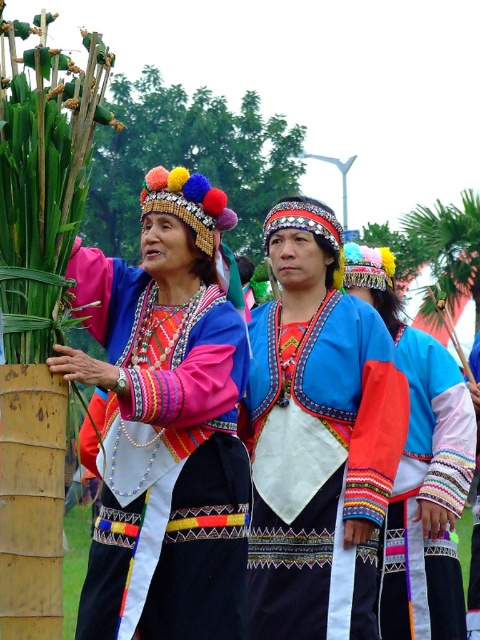
You are a photographer trying to capture the matte black dress at center in the scene. Based on the coordinates provided, where exactly should you aim your camera to ensure the dress is centered in your shot?

The matte black dress at center is located at coordinates point (166, 460), so aim your camera there to center it.

You are organizing a fashion show and need to decide which outfit to display first. The blue satin blouse at center and the multicolored woven fabric at center are both candidates. Based on their widths, which one should be chosen if you want the wider one displayed first?

The blue satin blouse at center might be wider than multicolored woven fabric at center, so it should be displayed first if you want the wider one.

You are a photographer trying to capture the blue satin blouse at center and the multicolored woven fabric at center in a single shot. Which object should you focus on first to ensure both are in sharp focus?

The blue satin blouse at center is closer to the viewer than the multicolored woven fabric at center, so you should focus on the blue satin blouse at center first to ensure both are in sharp focus.